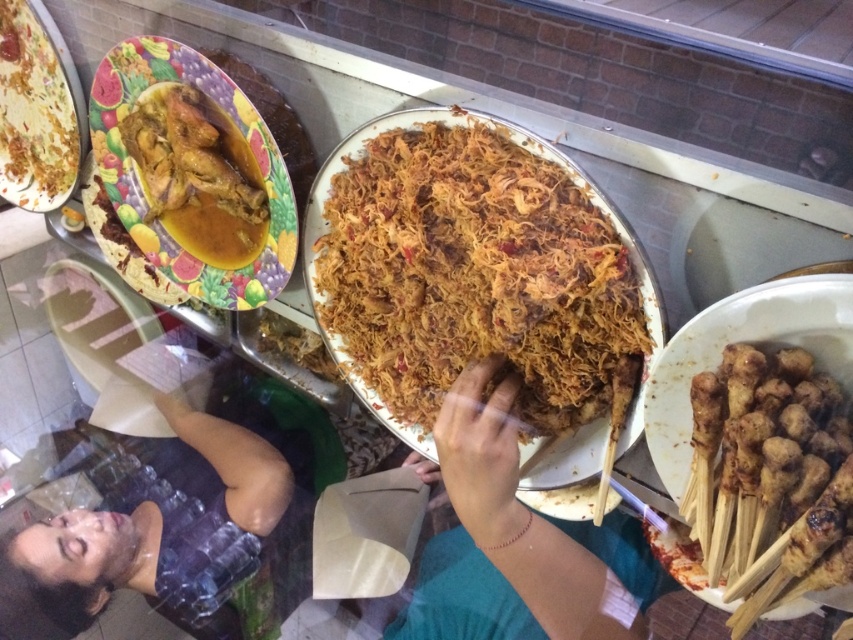
Between brown matte noodles at center and smooth skin at lower left, which one appears on the left side from the viewer's perspective?

smooth skin at lower left

Is point (599, 595) closer to viewer compared to point (68, 564)?

Yes.

Locate an element on the screen. The image size is (853, 640). brown matte noodles at center is located at coordinates (517, 541).

Does smooth skin at lower left have a smaller size compared to matte yellow plate at upper left?

No.

Between point (137, 577) and point (28, 134), which one is positioned in front?

Point (137, 577) is in front.

Locate an element on the screen. Image resolution: width=853 pixels, height=640 pixels. smooth skin at lower left is located at coordinates tap(154, 531).

Does brown matte skewers at lower right lie behind matte yellow plate at upper left?

No.

Which is in front, point (766, 500) or point (28, 115)?

Positioned in front is point (766, 500).

The image size is (853, 640). I want to click on brown matte skewers at lower right, so click(x=764, y=460).

At what (x,y) coordinates should I click in order to perform the action: click on brown matte skewers at lower right. Please return your answer as a coordinate pair (x, y). Looking at the image, I should click on (764, 460).